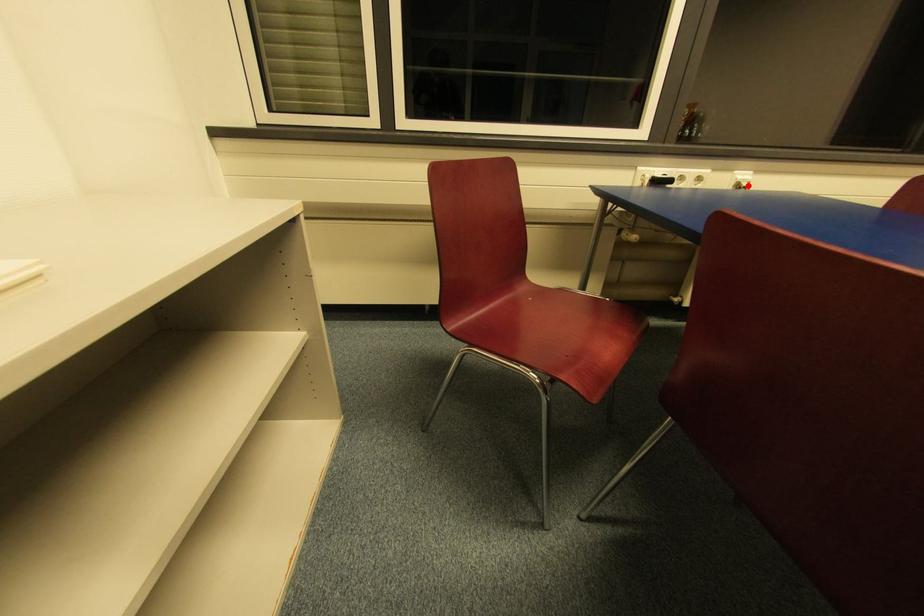
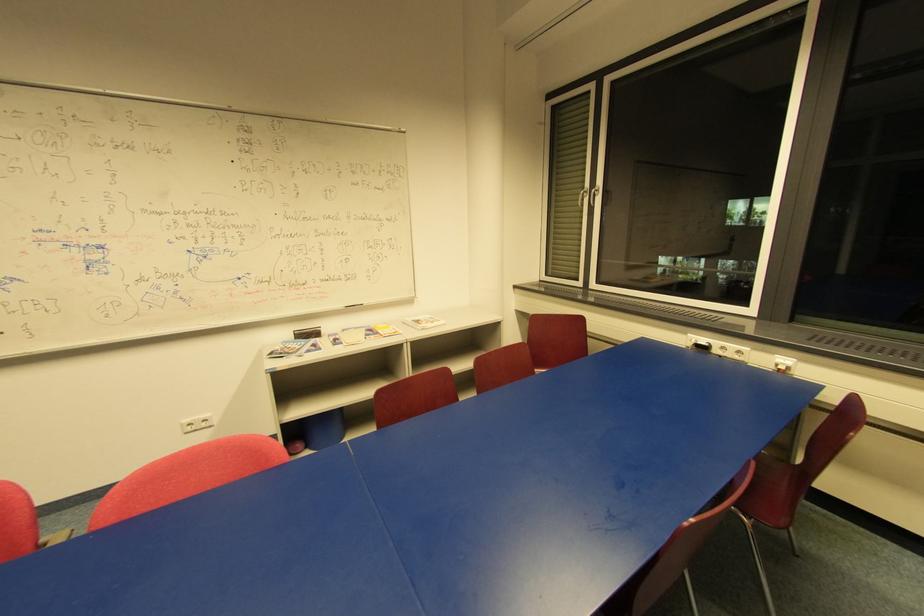
Find the pixel in the second image that matches the highlighted location in the first image.

(785, 369)